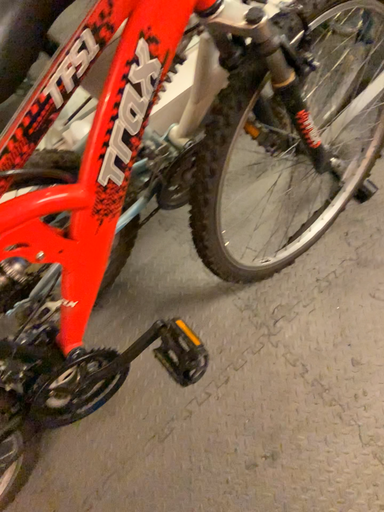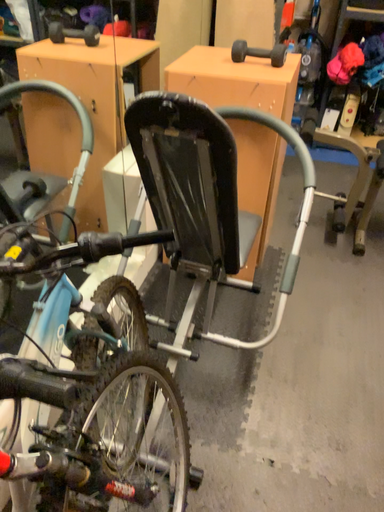
Question: How did the camera likely rotate when shooting the video?

Choices:
 (A) rotated upward
 (B) rotated downward

Answer: (A)